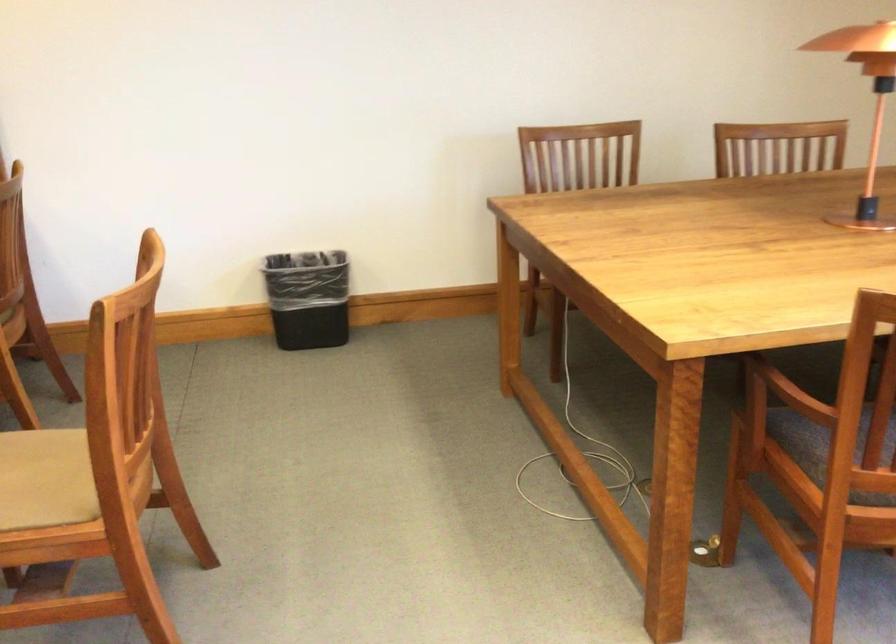
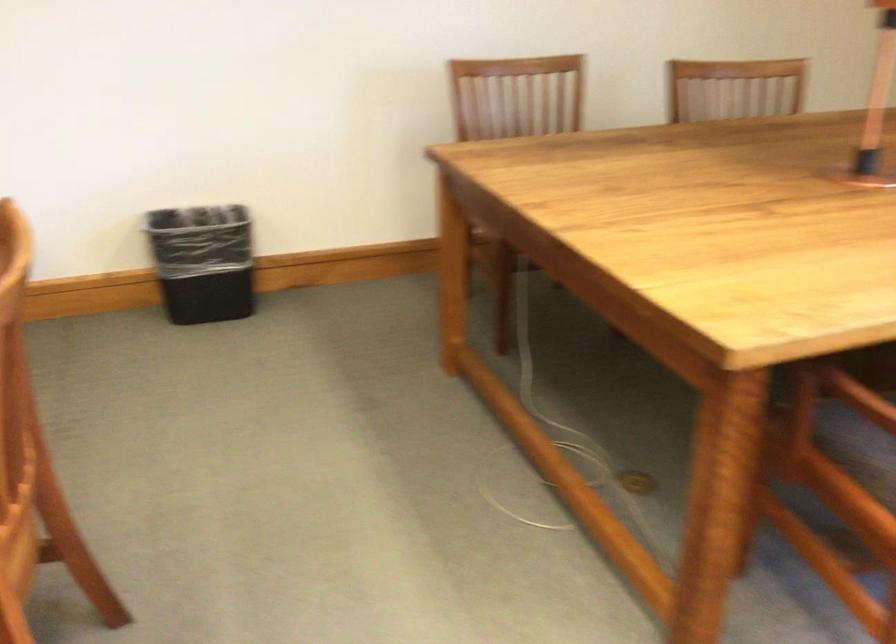
What movement of the cameraman would produce the second image?

The cameraman moved toward left, forward.